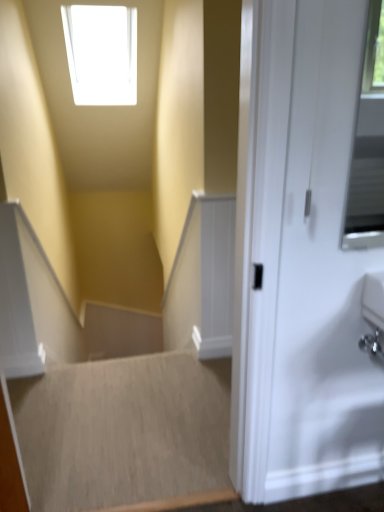
Question: Looking at their shapes, would you say smooth beige carpet at center, which ranks as the second stairwell in back-to-front order, is wider or thinner than beige carpet at lower left, placed as the 2th stairwell when sorted from front to back?

Choices:
 (A) thin
 (B) wide

Answer: (A)

Question: Based on their sizes in the image, would you say smooth beige carpet at center, which ranks as the second stairwell in back-to-front order, is bigger or smaller than beige carpet at lower left, placed as the 2th stairwell when sorted from front to back?

Choices:
 (A) small
 (B) big

Answer: (B)

Question: Is smooth beige carpet at center, which ranks as the second stairwell in back-to-front order, spatially inside beige carpet at lower left, arranged as the first stairwell when viewed from the back, or outside of it?

Choices:
 (A) inside
 (B) outside

Answer: (B)

Question: From the image's perspective, is beige carpet at lower left, arranged as the first stairwell when viewed from the back, above or below smooth beige carpet at center, the 1th stairwell positioned from the front?

Choices:
 (A) below
 (B) above

Answer: (A)

Question: From a real-world perspective, is beige carpet at lower left, placed as the 2th stairwell when sorted from front to back, physically located above or below smooth beige carpet at center, the 1th stairwell positioned from the front?

Choices:
 (A) below
 (B) above

Answer: (A)

Question: Based on their positions, is beige carpet at lower left, placed as the 2th stairwell when sorted from front to back, located to the left or right of smooth beige carpet at center, which ranks as the second stairwell in back-to-front order?

Choices:
 (A) right
 (B) left

Answer: (B)

Question: Considering the positions of beige carpet at lower left, placed as the 2th stairwell when sorted from front to back, and smooth beige carpet at center, which ranks as the second stairwell in back-to-front order, in the image, is beige carpet at lower left, placed as the 2th stairwell when sorted from front to back, bigger or smaller than smooth beige carpet at center, which ranks as the second stairwell in back-to-front order,?

Choices:
 (A) small
 (B) big

Answer: (A)